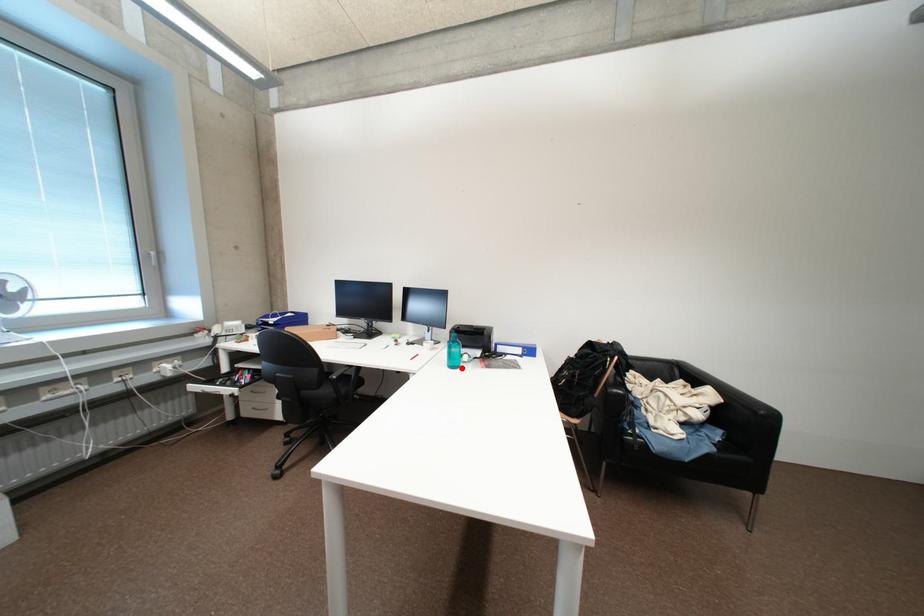
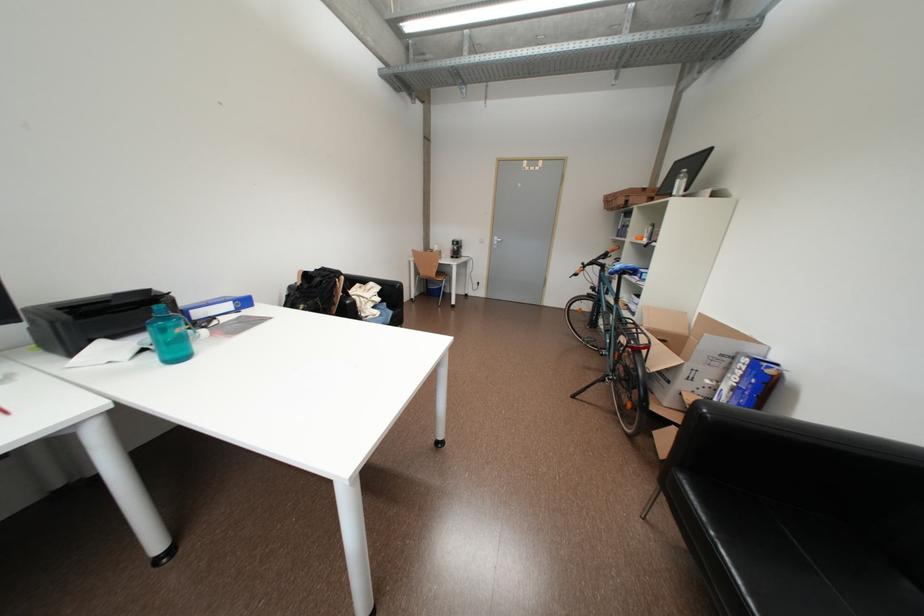
Find the pixel in the second image that matches the highlighted location in the first image.

(186, 360)